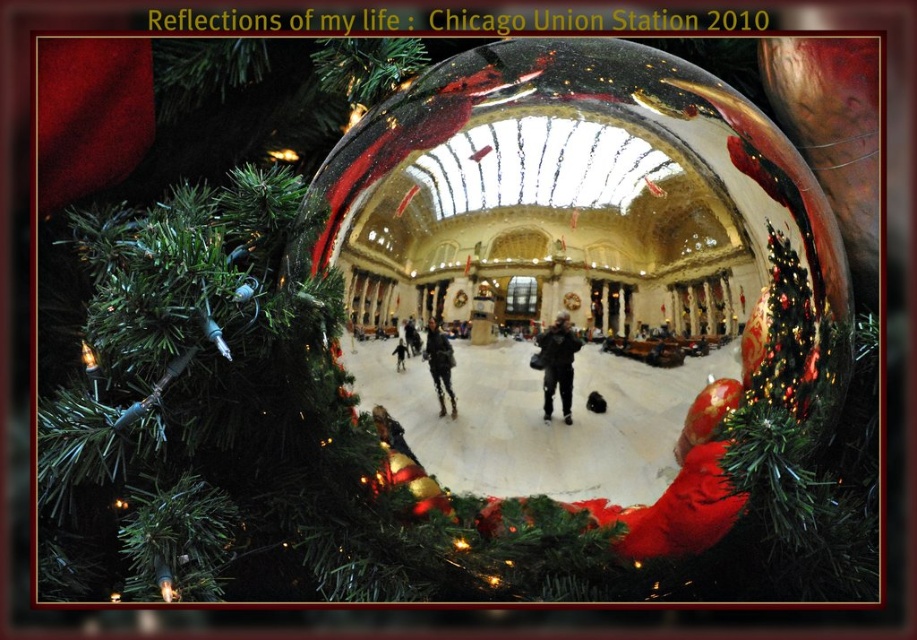
You are a tailor measuring jackets for alterations. You need to determine if the dark gray fabric jacket at center and the matte black jacket at center can be placed side by side on a 5 inch wide tailor table without overlapping. Can they fit?

The dark gray fabric jacket at center is 2.43 inches from matte black jacket at center. Since the distance between them is less than the 5 inch width of the table, they can be placed side by side without overlapping.

You are a photographer planning to take a portrait of two people wearing the dark gray fabric jacket at center and the matte black jacket at center. Since you want to ensure both jackets are visible in the frame, which jacket should you position closer to the camera to maintain their sizes in the photo?

The matte black jacket at center should be positioned closer to the camera because its actual width is smaller than the dark gray fabric jacket at center. By placing it nearer, both jackets will appear similar in size in the photograph.